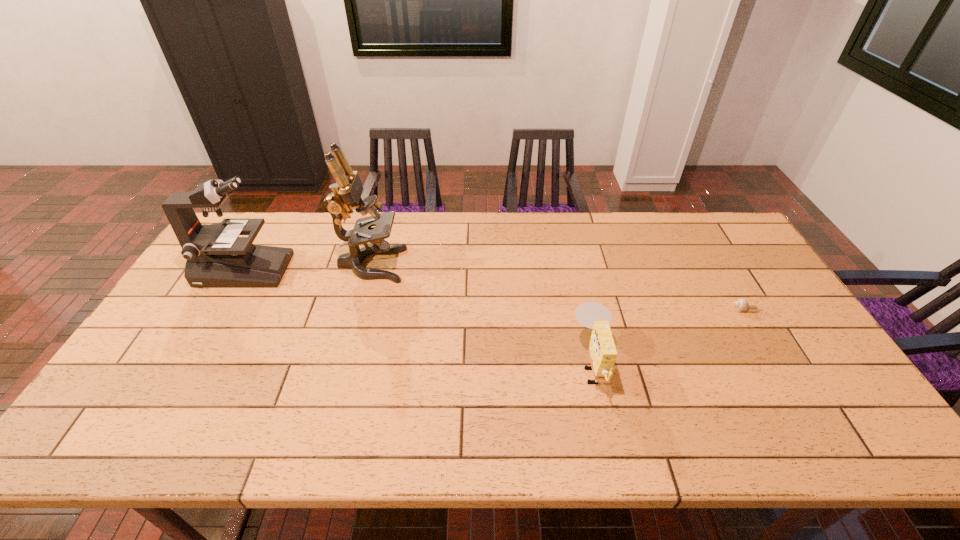
The image size is (960, 540). What are the coordinates of `free space at the near edge of the desktop` in the screenshot? It's located at (419, 425).

This screenshot has width=960, height=540. I want to click on free region at the left edge, so click(x=158, y=410).

Identify the location of free space at the right edge. Image resolution: width=960 pixels, height=540 pixels. pos(718,278).

The width and height of the screenshot is (960, 540). In order to click on vacant space at the far left corner of the desktop in this screenshot , I will do pos(259,217).

This screenshot has width=960, height=540. Identify the location of free space at the near right corner of the desktop. (810, 440).

You are a GUI agent. You are given a task and a screenshot of the screen. Output one action in this format:
    pyautogui.click(x=<x>, y=<y>)
    Task: Click on the free space that is in between the third tallest object and the escargot
    
    Given the screenshot: What is the action you would take?
    pyautogui.click(x=668, y=337)

The height and width of the screenshot is (540, 960). What are the coordinates of `unoccupied area between the taller microscope and the second object from right to left` in the screenshot? It's located at (482, 314).

Where is `empty space that is in between the taller microscope and the third shortest object`? The width and height of the screenshot is (960, 540). empty space that is in between the taller microscope and the third shortest object is located at coordinates (308, 267).

Identify the location of unoccupied area between the nearest object and the tallest object. (482, 314).

The height and width of the screenshot is (540, 960). I want to click on free space that is in between the third tallest object and the second nearest object, so click(668, 337).